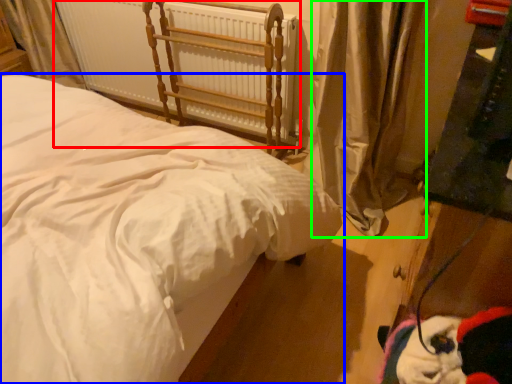
Question: Which is nearer to the radiator (highlighted by a red box)? bed (highlighted by a blue box) or curtain (highlighted by a green box).

Choices:
 (A) bed
 (B) curtain

Answer: (B)